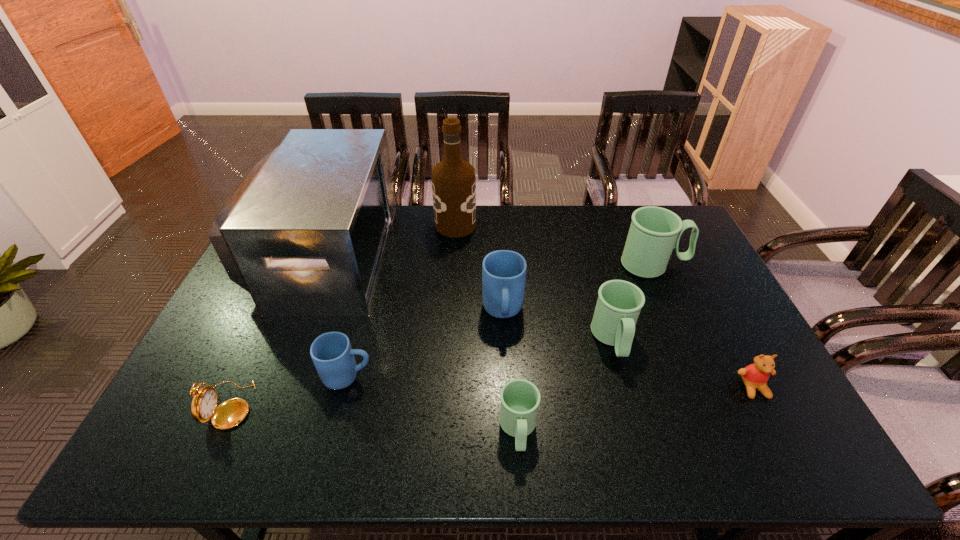
Locate an element on the screen. brown alcohol is located at coordinates (453, 180).

Locate an element on the screen. This screenshot has width=960, height=540. alcohol is located at coordinates (453, 180).

Where is `white microwave oven`? The width and height of the screenshot is (960, 540). white microwave oven is located at coordinates (305, 234).

Image resolution: width=960 pixels, height=540 pixels. Find the location of `the second tallest object`. the second tallest object is located at coordinates (x=305, y=234).

The width and height of the screenshot is (960, 540). I want to click on the farthest mug, so (x=654, y=232).

Locate an element on the screen. This screenshot has height=540, width=960. the rightmost mug is located at coordinates (654, 232).

Identify the location of the farther blue mug. (503, 272).

Find the location of `the right blue mug`. the right blue mug is located at coordinates (503, 272).

The image size is (960, 540). I want to click on the second mug from right to left, so click(619, 303).

Where is `the second green mug from left to right`? The height and width of the screenshot is (540, 960). the second green mug from left to right is located at coordinates (619, 303).